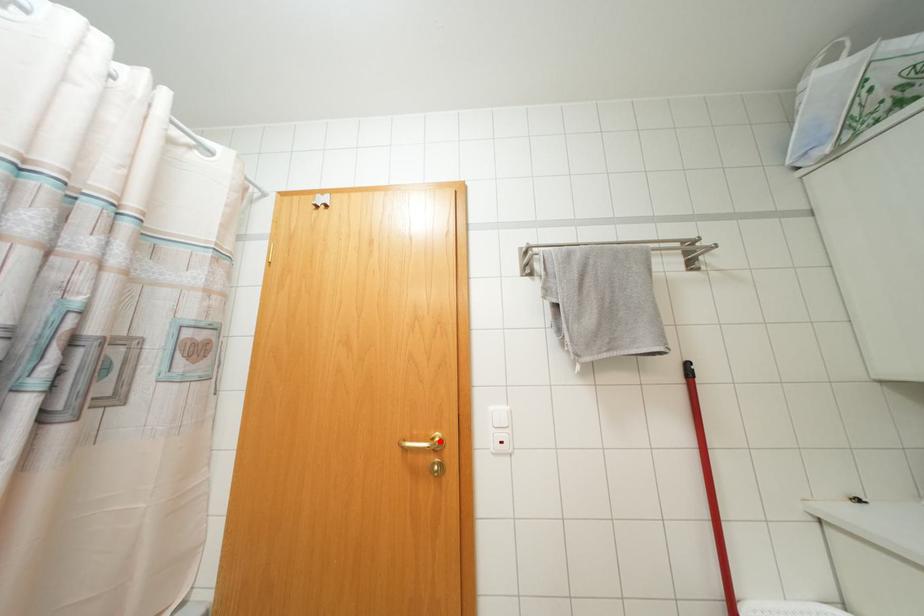
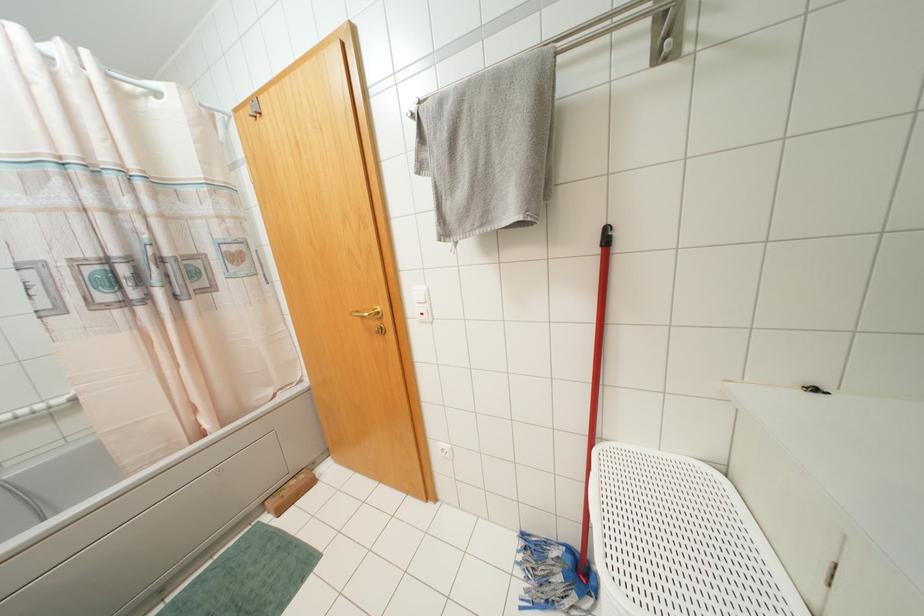
Where in the second image is the point corresponding to the highlighted location from the first image?

(378, 312)